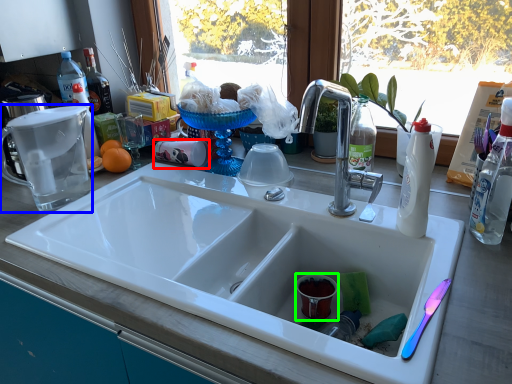
Question: Which object is the farthest from coffee cup (highlighted by a red box)? Choose among these: appliance (highlighted by a blue box) or coffee cup (highlighted by a green box).

Choices:
 (A) appliance
 (B) coffee cup

Answer: (B)